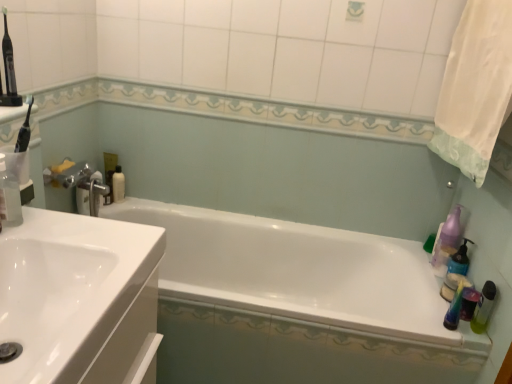
Question: Does white glossy sink at left have a greater height compared to translucent plastic mouthwash at right, the first mouthwash in the front-to-back sequence?

Choices:
 (A) yes
 (B) no

Answer: (B)

Question: From the image's perspective, does white glossy sink at left appear higher than translucent plastic mouthwash at right, which ranks as the second mouthwash in left-to-right order?

Choices:
 (A) no
 (B) yes

Answer: (B)

Question: Can you confirm if white glossy sink at left is wider than translucent plastic mouthwash at right, marked as the first mouthwash in a right-to-left arrangement?

Choices:
 (A) no
 (B) yes

Answer: (B)

Question: Would you say white glossy sink at left is outside translucent plastic mouthwash at right, the second mouthwash from the back?

Choices:
 (A) yes
 (B) no

Answer: (A)

Question: Can you confirm if white glossy sink at left is shorter than translucent plastic mouthwash at right, which ranks as the second mouthwash in left-to-right order?

Choices:
 (A) no
 (B) yes

Answer: (B)

Question: Does point (4, 208) appear closer or farther from the camera than point (457, 59)?

Choices:
 (A) farther
 (B) closer

Answer: (B)

Question: Considering the positions of transparent plastic bottle at left, the 1th cleaning product positioned from the front, and white fabric shower curtain at upper right in the image, is transparent plastic bottle at left, the 1th cleaning product positioned from the front, bigger or smaller than white fabric shower curtain at upper right?

Choices:
 (A) big
 (B) small

Answer: (B)

Question: Relative to white fabric shower curtain at upper right, is transparent plastic bottle at left, the 3th cleaning product viewed from the back, in front or behind?

Choices:
 (A) behind
 (B) front

Answer: (B)

Question: Is transparent plastic bottle at left, the 3th cleaning product viewed from the back, inside or outside of white fabric shower curtain at upper right?

Choices:
 (A) inside
 (B) outside

Answer: (B)

Question: Does point (465, 284) appear closer or farther from the camera than point (433, 139)?

Choices:
 (A) closer
 (B) farther

Answer: (A)

Question: Is translucent plastic mouthwash at right, which ranks as the second mouthwash in left-to-right order, inside or outside of white fabric shower curtain at upper right?

Choices:
 (A) inside
 (B) outside

Answer: (B)

Question: Is translucent plastic mouthwash at right, marked as the first mouthwash in a right-to-left arrangement, taller or shorter than white fabric shower curtain at upper right?

Choices:
 (A) short
 (B) tall

Answer: (A)

Question: Considering the relative positions of translucent plastic mouthwash at right, which ranks as the second mouthwash in left-to-right order, and white fabric shower curtain at upper right in the image provided, is translucent plastic mouthwash at right, which ranks as the second mouthwash in left-to-right order, to the left or to the right of white fabric shower curtain at upper right?

Choices:
 (A) left
 (B) right

Answer: (A)

Question: Do you think white glossy sink at left is within purple translucent soap dispenser at right, which is the 1th cleaning product in right-to-left order, or outside of it?

Choices:
 (A) inside
 (B) outside

Answer: (B)

Question: Is point (66, 236) positioned closer to the camera than point (433, 266)?

Choices:
 (A) closer
 (B) farther

Answer: (A)